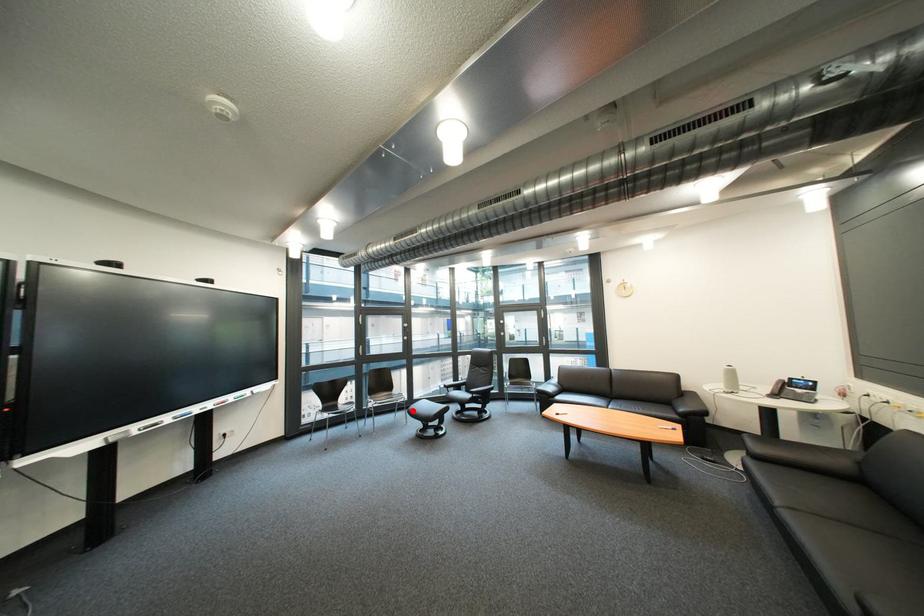
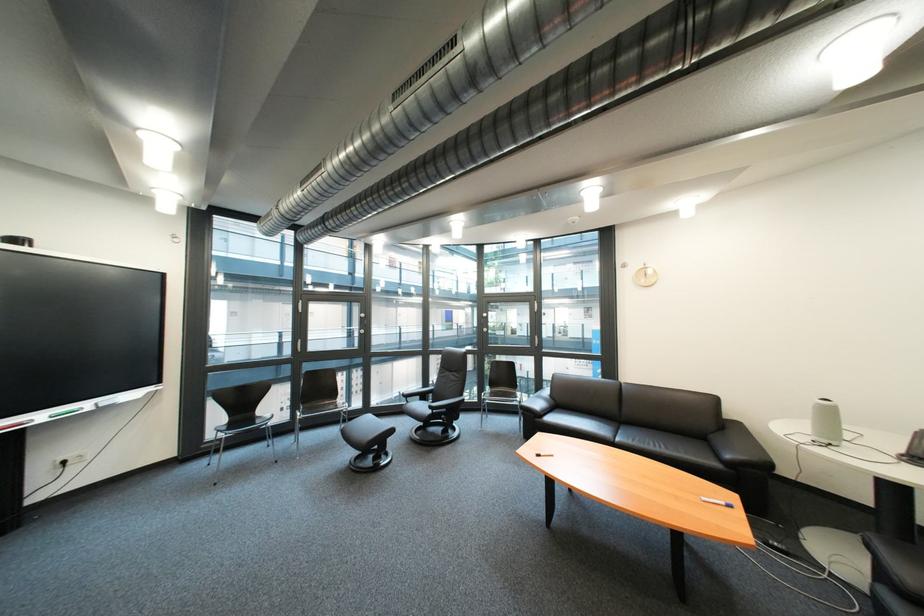
Question: A red point is marked in image1. In image2, is the corresponding 3D point closer to the camera or farther? Reply with the corresponding letter.

Choices:
 (A) The corresponding 3D point is closer.
 (B) The corresponding 3D point is farther.

Answer: (B)